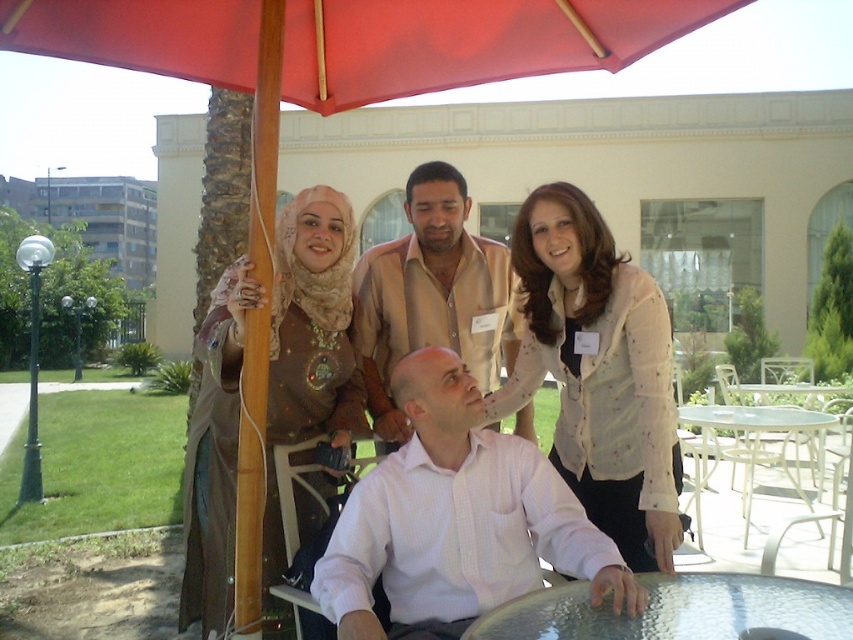
You are sitting at the white painted wood chair at lower right and want to place your drink on the nearest table. Is the clear glass table at center the closest table to you?

The clear glass table at center is closer to the viewer than the white painted wood chair at lower right, so yes, the clear glass table at center is the closest table to you.

Consider the image. You are a photographer trying to capture a clear shot of the matte beige shirt at center without the red fabric umbrella at upper center blocking it. What adjustment should you make to your camera position?

The red fabric umbrella at upper center is in front of the matte beige shirt at center, so you should move your camera position backward to ensure the umbrella is no longer blocking the shirt.